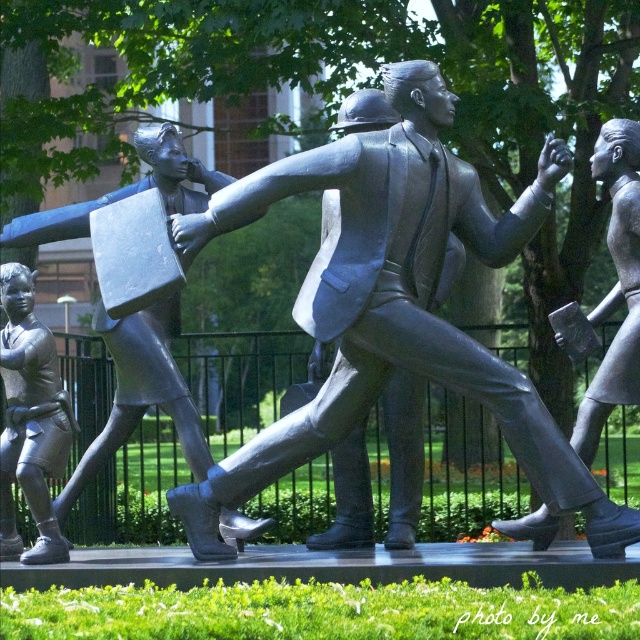
Is bronze statue at left wider than brushed metal boy at lower left?

Correct, the width of bronze statue at left exceeds that of brushed metal boy at lower left.

Can you confirm if bronze statue at left is taller than brushed metal boy at lower left?

Incorrect, bronze statue at left's height is not larger of brushed metal boy at lower left's.

Find the location of a particular element. Image resolution: width=640 pixels, height=640 pixels. bronze statue at left is located at coordinates (140, 392).

The image size is (640, 640). What do you see at coordinates (396, 305) in the screenshot?
I see `polished bronze statue at center` at bounding box center [396, 305].

Which is more to the right, polished bronze statue at center or brushed metal boy at lower left?

Positioned to the right is polished bronze statue at center.

Image resolution: width=640 pixels, height=640 pixels. I want to click on polished bronze statue at center, so click(x=396, y=305).

Does brushed metal boy at lower left appear under polished bronze statue at right?

Correct, brushed metal boy at lower left is located below polished bronze statue at right.

The image size is (640, 640). Describe the element at coordinates (33, 412) in the screenshot. I see `brushed metal boy at lower left` at that location.

Who is more forward, (4, 460) or (522, 536)?

Point (522, 536) is in front.

At what (x,y) coordinates should I click in order to perform the action: click on brushed metal boy at lower left. Please return your answer as a coordinate pair (x, y). The image size is (640, 640). Looking at the image, I should click on (33, 412).